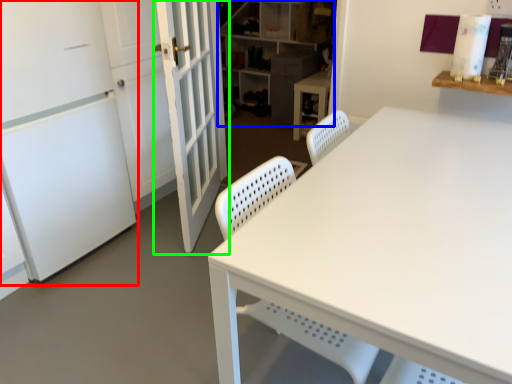
Question: Based on their relative distances, which object is nearer to screen door (highlighted by a red box)? Choose from shelf (highlighted by a blue box) and door (highlighted by a green box).

Choices:
 (A) shelf
 (B) door

Answer: (B)